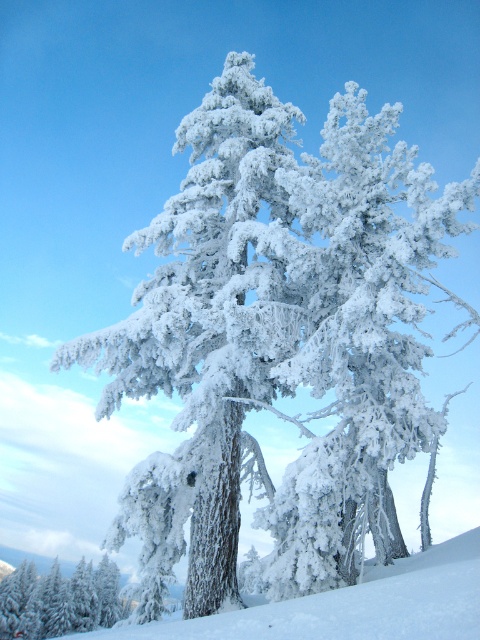
You are an observer standing in the winter landscape. You notice the white snow at center and the white frosty tree at lower left. Which object covers a bigger area in the image?

The white snow at center is larger in size than the white frosty tree at lower left, so it covers a bigger area in the image.

You are an observer standing in the winter landscape scene. You notice the white snow at center and the white frosty tree at lower left. Which object occupies more horizontal space in the image?

The white frosty tree at lower left has a greater width than the white snow at center, so it occupies more horizontal space in the image.

You are an observer standing at the edge of the winter landscape. You notice the white snow at center and the white frosty tree at lower left. Which object appears taller in the scene?

The white snow at center is much taller than the white frosty tree at lower left.